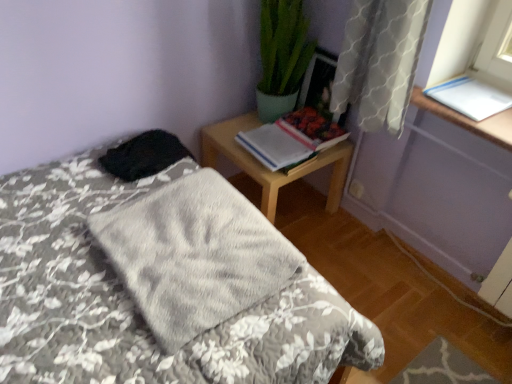
At what (x,y) coordinates should I click in order to perform the action: click on fluffy gray blanket at center. Please return your answer as a coordinate pair (x, y). Looking at the image, I should click on (135, 304).

The width and height of the screenshot is (512, 384). What do you see at coordinates (318, 80) in the screenshot?
I see `wooden picture frame at upper right` at bounding box center [318, 80].

This screenshot has height=384, width=512. What do you see at coordinates (273, 147) in the screenshot?
I see `hardcover book at upper right, the first book in the left-to-right sequence` at bounding box center [273, 147].

Measure the distance between hardcover book at upper right, arranged as the 3th book when viewed from the right, and camera.

6.10 feet.

The width and height of the screenshot is (512, 384). Identify the location of hardcover book at upper right, the 2th book in the right-to-left sequence. (309, 138).

Where is `wooden nightstand at upper right`? The height and width of the screenshot is (384, 512). wooden nightstand at upper right is located at coordinates (268, 169).

The height and width of the screenshot is (384, 512). I want to click on gray soft blanket at center, so click(194, 255).

Is wooden picture frame at upper right wider than hardcover book at upper right, arranged as the second book when viewed from the left?

No.

Is wooden picture frame at upper right not near hardcover book at upper right, the 2th book in the right-to-left sequence?

No, wooden picture frame at upper right is in close proximity to hardcover book at upper right, the 2th book in the right-to-left sequence.

From the image's perspective, does wooden picture frame at upper right appear lower than hardcover book at upper right, the 2th book in the right-to-left sequence?

No, from the image's perspective, wooden picture frame at upper right is not beneath hardcover book at upper right, the 2th book in the right-to-left sequence.

Is fluffy gray blanket at center positioned far away from white paper at upper right, placed as the first book when sorted from right to left?

Indeed, fluffy gray blanket at center is not near white paper at upper right, placed as the first book when sorted from right to left.

Which of these two, fluffy gray blanket at center or white paper at upper right, marked as the 3th book in a left-to-right arrangement, stands taller?

Standing taller between the two is fluffy gray blanket at center.

From the image's perspective, relative to white paper at upper right, placed as the first book when sorted from right to left, is fluffy gray blanket at center above or below?

From the image's perspective, fluffy gray blanket at center appears below white paper at upper right, placed as the first book when sorted from right to left.

Considering the relative positions of fluffy gray blanket at center and white paper at upper right, marked as the 3th book in a left-to-right arrangement, in the image provided, is fluffy gray blanket at center in front of white paper at upper right, marked as the 3th book in a left-to-right arrangement,?

That is True.

Looking at their sizes, would you say hardcover book at upper right, arranged as the 3th book when viewed from the right, is wider or thinner than wooden nightstand at upper right?

In the image, hardcover book at upper right, arranged as the 3th book when viewed from the right, appears to be more narrow than wooden nightstand at upper right.

Considering the points (253, 131) and (236, 149), which point is in front, point (253, 131) or point (236, 149)?

Point (236, 149)

Who is taller, hardcover book at upper right, arranged as the 3th book when viewed from the right, or wooden nightstand at upper right?

wooden nightstand at upper right is taller.

Is hardcover book at upper right, the first book in the left-to-right sequence, completely or partially outside of wooden nightstand at upper right?

hardcover book at upper right, the first book in the left-to-right sequence, lies outside wooden nightstand at upper right's area.

Is hardcover book at upper right, the first book in the left-to-right sequence, turned away from fluffy gray blanket at center?

hardcover book at upper right, the first book in the left-to-right sequence, is not turned away from fluffy gray blanket at center.

Considering the sizes of hardcover book at upper right, the first book in the left-to-right sequence, and fluffy gray blanket at center in the image, is hardcover book at upper right, the first book in the left-to-right sequence, wider or thinner than fluffy gray blanket at center?

Considering their sizes, hardcover book at upper right, the first book in the left-to-right sequence, looks slimmer than fluffy gray blanket at center.

Looking at this image, from a real-world perspective, which object rests below the other?

From a 3D spatial view, fluffy gray blanket at center is below.

Find the location of `book that is the 2nd one below the white paper at upper right, marked as the 3th book in a left-to-right arrangement (from a real-world perspective)`. book that is the 2nd one below the white paper at upper right, marked as the 3th book in a left-to-right arrangement (from a real-world perspective) is located at coordinates (273, 147).

From a real-world perspective, who is located lower, white paper at upper right, placed as the first book when sorted from right to left, or hardcover book at upper right, the first book in the left-to-right sequence?

hardcover book at upper right, the first book in the left-to-right sequence.

From the image's perspective, who appears lower, white paper at upper right, marked as the 3th book in a left-to-right arrangement, or hardcover book at upper right, the first book in the left-to-right sequence?

hardcover book at upper right, the first book in the left-to-right sequence, from the image's perspective.

Is white paper at upper right, marked as the 3th book in a left-to-right arrangement, turned away from hardcover book at upper right, arranged as the 3th book when viewed from the right?

white paper at upper right, marked as the 3th book in a left-to-right arrangement, is not turned away from hardcover book at upper right, arranged as the 3th book when viewed from the right.

Which object is more forward, hardcover book at upper right, arranged as the second book when viewed from the left, or white paper at upper right, marked as the 3th book in a left-to-right arrangement?

white paper at upper right, marked as the 3th book in a left-to-right arrangement.

Who is smaller, hardcover book at upper right, the 2th book in the right-to-left sequence, or white paper at upper right, placed as the first book when sorted from right to left?

Smaller between the two is white paper at upper right, placed as the first book when sorted from right to left.

Is white paper at upper right, marked as the 3th book in a left-to-right arrangement, at the back of hardcover book at upper right, the 2th book in the right-to-left sequence?

hardcover book at upper right, the 2th book in the right-to-left sequence, does not have its back to white paper at upper right, marked as the 3th book in a left-to-right arrangement.

Considering the sizes of objects hardcover book at upper right, the 2th book in the right-to-left sequence, and white paper at upper right, marked as the 3th book in a left-to-right arrangement, in the image provided, who is shorter, hardcover book at upper right, the 2th book in the right-to-left sequence, or white paper at upper right, marked as the 3th book in a left-to-right arrangement,?

Standing shorter between the two is white paper at upper right, marked as the 3th book in a left-to-right arrangement.

Does wooden picture frame at upper right appear on the left side of white paper at upper right, placed as the first book when sorted from right to left?

Yes, wooden picture frame at upper right is to the left of white paper at upper right, placed as the first book when sorted from right to left.

From the picture: From the image's perspective, is wooden picture frame at upper right positioned above or below white paper at upper right, placed as the first book when sorted from right to left?

wooden picture frame at upper right is above white paper at upper right, placed as the first book when sorted from right to left.

Consider the image. Is wooden picture frame at upper right positioned far away from white paper at upper right, placed as the first book when sorted from right to left?

That's not correct — wooden picture frame at upper right is a little close to white paper at upper right, placed as the first book when sorted from right to left.

At what (x,y) coordinates should I click in order to perform the action: click on the 2nd book below when counting from the wooden picture frame at upper right (from the image's perspective). Please return your answer as a coordinate pair (x, y). This screenshot has width=512, height=384. Looking at the image, I should click on (309, 138).

This screenshot has height=384, width=512. I want to click on the 3rd book above the fluffy gray blanket at center (from the image's perspective), so click(471, 97).

Considering their positions, is fluffy gray blanket at center positioned further to wooden picture frame at upper right than hardcover book at upper right, arranged as the second book when viewed from the left?

Based on the image, fluffy gray blanket at center appears to be further to wooden picture frame at upper right.

Based on their spatial positions, is gray soft blanket at center or fluffy gray blanket at center further from hardcover book at upper right, arranged as the 3th book when viewed from the right?

fluffy gray blanket at center.

From the image, which object appears to be farther from wooden nightstand at upper right, gray soft blanket at center or hardcover book at upper right, arranged as the second book when viewed from the left?

Based on the image, gray soft blanket at center appears to be further to wooden nightstand at upper right.

From the image, which object appears to be farther from fluffy gray blanket at center, wooden nightstand at upper right or hardcover book at upper right, arranged as the second book when viewed from the left?

hardcover book at upper right, arranged as the second book when viewed from the left, is further to fluffy gray blanket at center.

From the image, which object appears to be nearer to fluffy gray blanket at center, gray soft blanket at center or wooden picture frame at upper right?

gray soft blanket at center lies closer to fluffy gray blanket at center than the other object.

When comparing their distances from fluffy gray blanket at center, does white paper at upper right, marked as the 3th book in a left-to-right arrangement, or gray soft blanket at center seem closer?

gray soft blanket at center is closer to fluffy gray blanket at center.

Looking at this image, based on their spatial positions, is hardcover book at upper right, arranged as the 3th book when viewed from the right, or fluffy gray blanket at center further from hardcover book at upper right, arranged as the second book when viewed from the left?

The object further to hardcover book at upper right, arranged as the second book when viewed from the left, is fluffy gray blanket at center.

Considering their positions, is wooden picture frame at upper right positioned closer to wooden nightstand at upper right than white paper at upper right, marked as the 3th book in a left-to-right arrangement?

wooden picture frame at upper right is closer to wooden nightstand at upper right.

I want to click on book between wooden nightstand at upper right and white paper at upper right, marked as the 3th book in a left-to-right arrangement, in the horizontal direction, so click(x=309, y=138).

What are the coordinates of `blanket located between fluffy gray blanket at center and wooden picture frame at upper right in the depth direction` in the screenshot? It's located at (194, 255).

You are a GUI agent. You are given a task and a screenshot of the screen. Output one action in this format:
    pyautogui.click(x=<x>, y=<y>)
    Task: Click on the nightstand positioned between gray soft blanket at center and hardcover book at upper right, arranged as the second book when viewed from the left, from near to far
    The width and height of the screenshot is (512, 384).
    Given the screenshot: What is the action you would take?
    pyautogui.click(x=268, y=169)

You are a GUI agent. You are given a task and a screenshot of the screen. Output one action in this format:
    pyautogui.click(x=<x>, y=<y>)
    Task: Click on the book between hardcover book at upper right, arranged as the 3th book when viewed from the right, and white paper at upper right, placed as the first book when sorted from right to left
    The width and height of the screenshot is (512, 384).
    Given the screenshot: What is the action you would take?
    (309, 138)